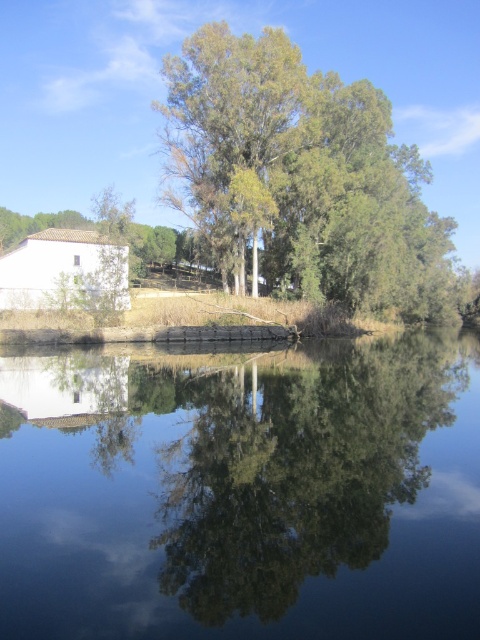
You are standing at the origin point in the scene. Where is the transparent glass lake at center located in terms of its 2D coordinates?

The transparent glass lake at center is located at the 2D coordinates of point (242, 492).

You are standing at the edge of the transparent glass lake at center and want to reach the point marked as point (242, 492). Since the lake is transparent, you can see the bottom clearly. How would you describe the path to reach that point?

The point (242, 492) is located on the transparent glass lake at center, so you can walk directly towards it along the lake bottom since the lake is transparent and the path is visible.

You are standing on the dock and want to take a photo of the transparent glass lake at center and the green leafy tree at upper center. Which object is positioned to the left of the other?

The transparent glass lake at center is to the left of green leafy tree at upper center.